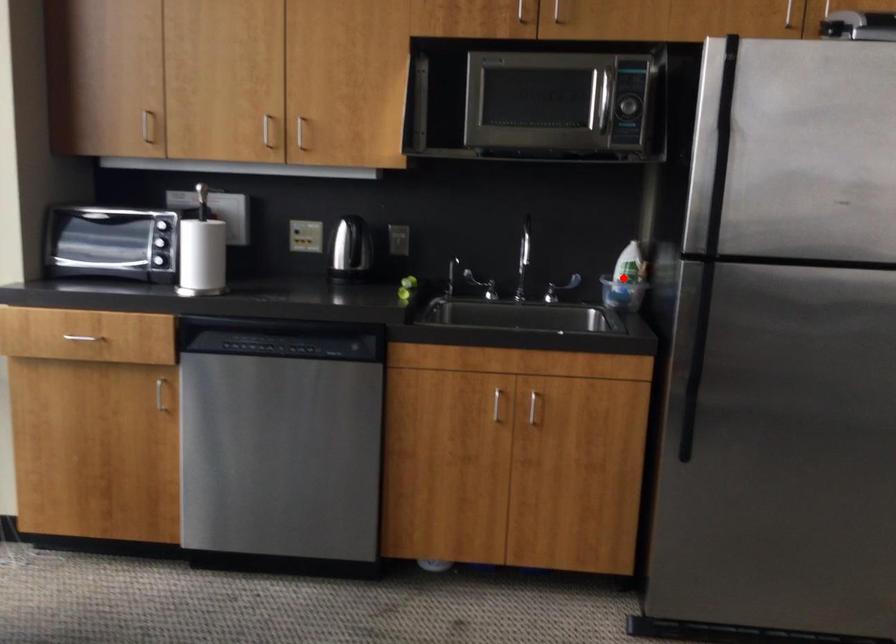
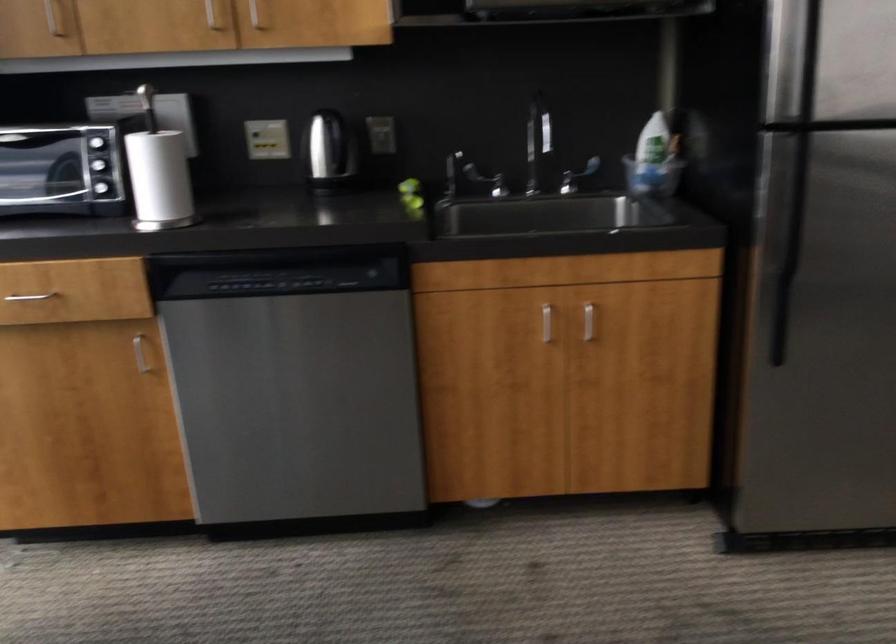
Question: I am providing you with two images of the same scene from different viewpoints. A red point is shown in image1. For the corresponding object point in image2, is it positioned nearer or farther from the camera?

Choices:
 (A) Nearer
 (B) Farther

Answer: (A)